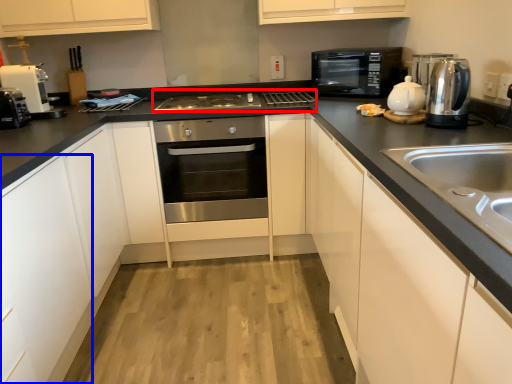
Question: Which object appears closest to the camera in this image, gas stove (highlighted by a red box) or cabinetry (highlighted by a blue box)?

Choices:
 (A) gas stove
 (B) cabinetry

Answer: (B)